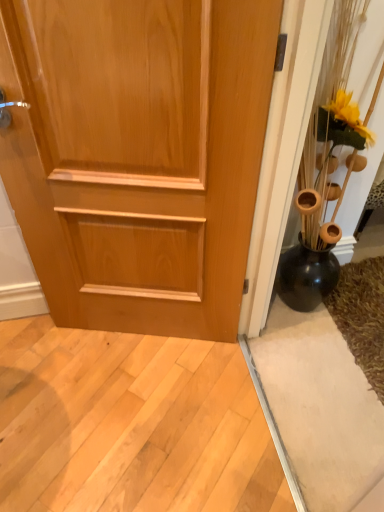
Locate an element on the screen. The height and width of the screenshot is (512, 384). glossy wood door at center is located at coordinates [x=138, y=154].

This screenshot has height=512, width=384. What do you see at coordinates (138, 154) in the screenshot?
I see `glossy wood door at center` at bounding box center [138, 154].

This screenshot has height=512, width=384. I want to click on glossy wood door at center, so click(138, 154).